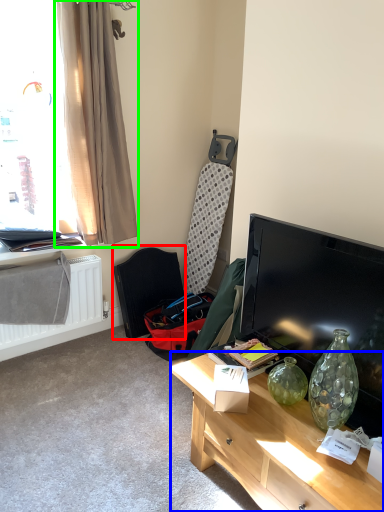
Question: Which is farther away from swivel chair (highlighted by a red box)? desk (highlighted by a blue box) or curtain (highlighted by a green box)?

Choices:
 (A) desk
 (B) curtain

Answer: (A)